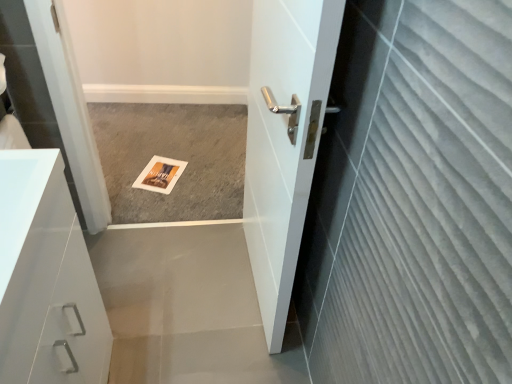
Question: Based on their positions, is white glossy cabinet at left located to the left or right of white glossy door at center?

Choices:
 (A) right
 (B) left

Answer: (B)

Question: In terms of size, does white glossy cabinet at left appear bigger or smaller than white glossy door at center?

Choices:
 (A) big
 (B) small

Answer: (B)

Question: Based on their relative distances, which object is nearer to the gray carpet at center?

Choices:
 (A) white glossy door at center
 (B) white glossy cabinet at left

Answer: (A)

Question: Which object is the farthest from the gray carpet at center?

Choices:
 (A) white glossy door at center
 (B) white glossy cabinet at left

Answer: (B)